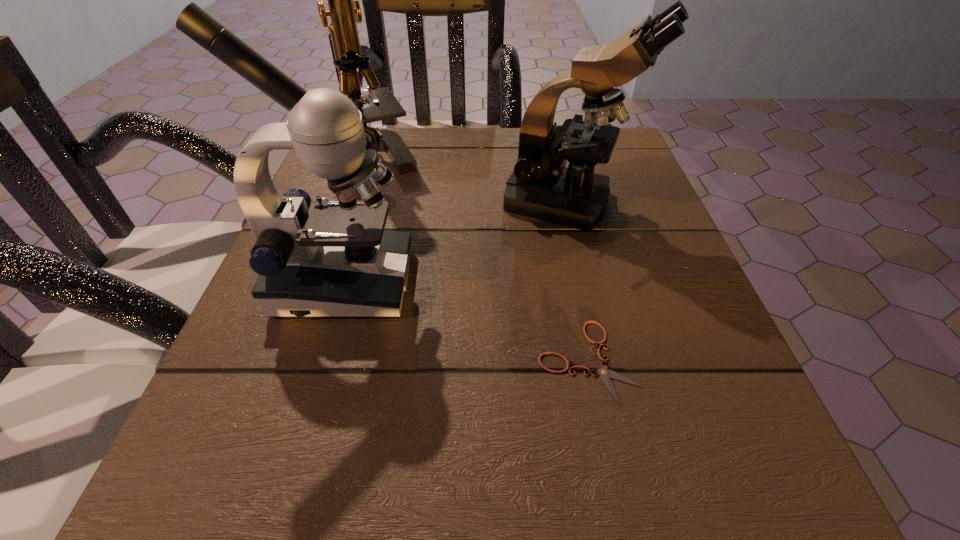
Locate an element on the screen. microscope identified as the closest to the shears is located at coordinates (330, 258).

Locate which microscope is the second closest to the rightmost microscope. Please provide its 2D coordinates. Your answer should be formatted as a tuple, i.e. [(x, y)], where the tuple contains the x and y coordinates of a point satisfying the conditions above.

[(344, 9)]

The height and width of the screenshot is (540, 960). In order to click on free space that satisfies the following two spatial constraints: 1. on the back side of the rightmost microscope; 2. on the left side of the nearest microscope in this screenshot , I will do `click(369, 201)`.